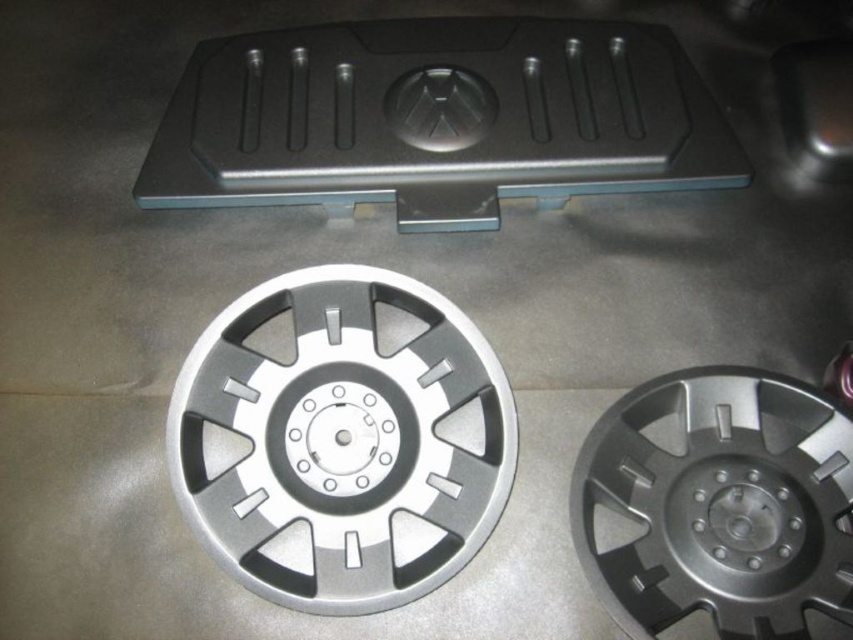
Who is taller, black plastic cover at center or silver metallic wheel at center?

Standing taller between the two is black plastic cover at center.

Where is `black plastic cover at center`? This screenshot has height=640, width=853. black plastic cover at center is located at coordinates (438, 118).

Locate an element on the screen. Image resolution: width=853 pixels, height=640 pixels. black plastic cover at center is located at coordinates (438, 118).

Does point (426, 508) lie in front of point (628, 563)?

No, it is not.

Is silver metallic hubcap at center behind silver metallic wheel at center?

Yes, silver metallic hubcap at center is behind silver metallic wheel at center.

The image size is (853, 640). What do you see at coordinates (343, 442) in the screenshot?
I see `silver metallic hubcap at center` at bounding box center [343, 442].

Find the location of a particular element. This screenshot has width=853, height=640. silver metallic hubcap at center is located at coordinates (343, 442).

Is black plastic cover at center thinner than silver metallic hubcap at center?

In fact, black plastic cover at center might be wider than silver metallic hubcap at center.

Identify the location of black plastic cover at center. (438, 118).

Does point (665, 60) lie in front of point (270, 316)?

No.

The image size is (853, 640). In order to click on black plastic cover at center in this screenshot , I will do `click(438, 118)`.